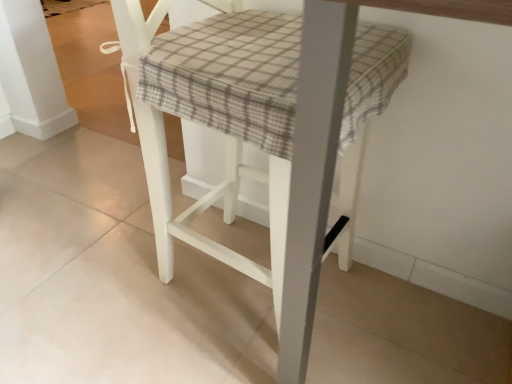
Find the location of `vacant space underneath white fabric-covered stool at center (from a real-world perspective)`. vacant space underneath white fabric-covered stool at center (from a real-world perspective) is located at coordinates (224, 282).